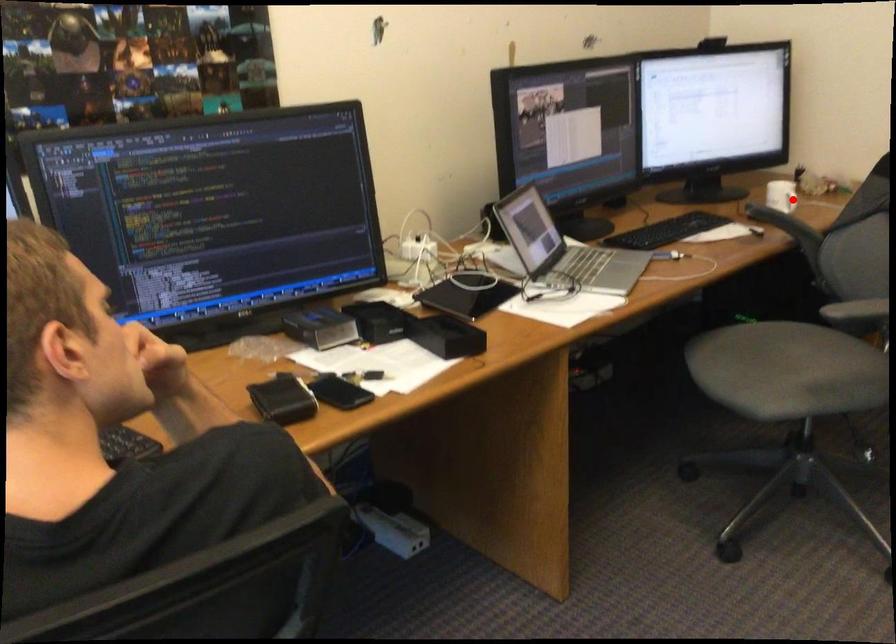
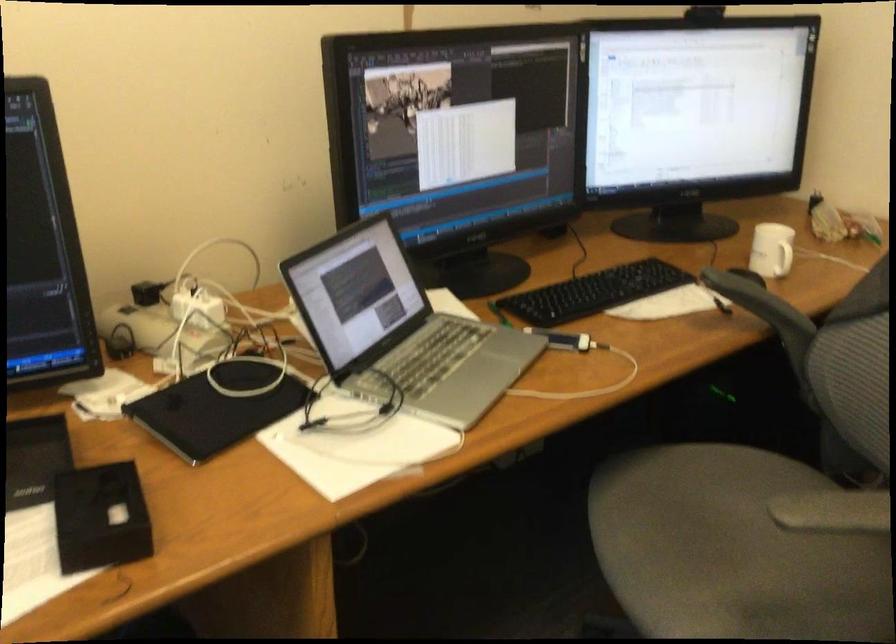
The point at the highlighted location is marked in the first image. Where is the corresponding point in the second image?

(782, 259)